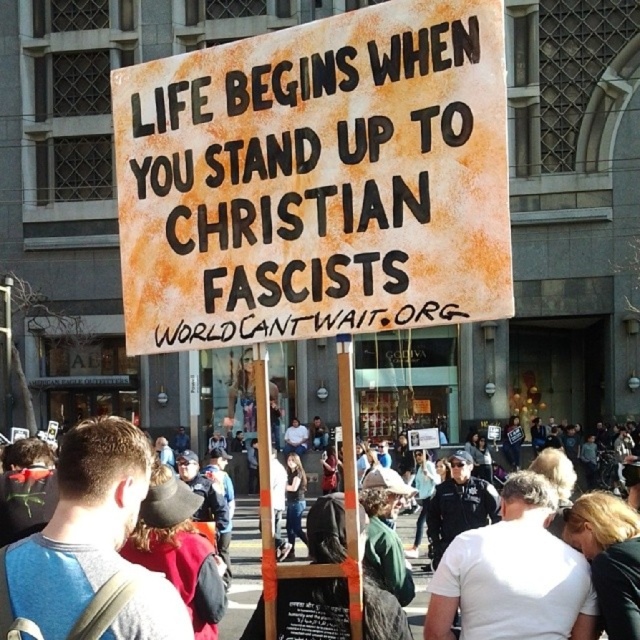
You are a photographer standing in the middle of the protest. You want to take a closeup photo of the rusty cardboard sign at center without moving closer than 10 meters. Can you do it?

The rusty cardboard sign at center is 12.87 meters away from the viewer. Since you can stay at your current position which is 12.87 meters away, which is more than 10 meters, you can take the closeup photo without moving closer than 10 meters.

You are a photographer standing at the edge of the protest crowd. You want to take a photo of the rusty cardboard sign at center and the white cotton shirt at center so that both are clearly visible in the frame. Given that your camera has a minimum focus distance of 15 feet, will you need to step back to ensure both subjects are in focus?

The distance between the rusty cardboard sign at center and the white cotton shirt at center is 14.78 feet. Since this distance is less than the camera minimum focus distance of 15 feet, you will need to step back to ensure both subjects are in focus.